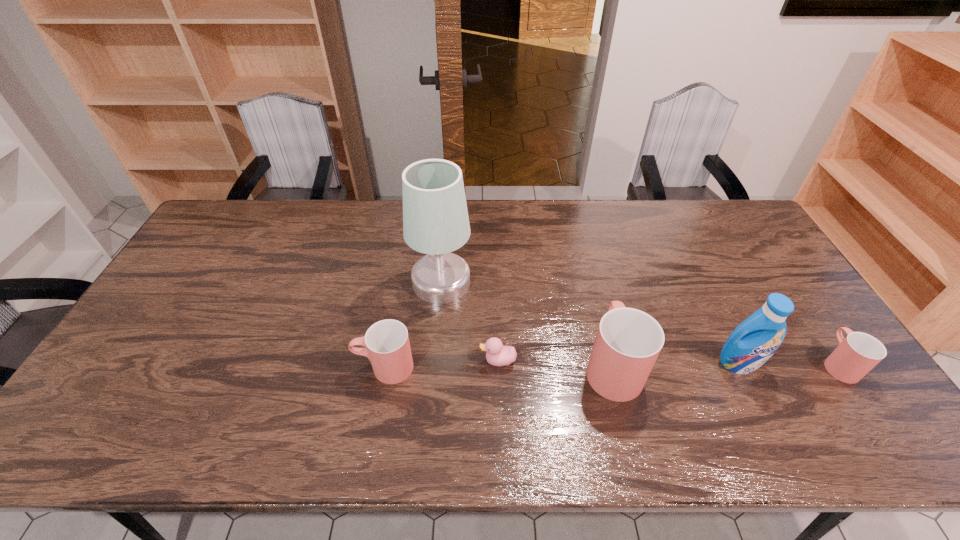
I want to click on free space located on the side of the fifth tallest object with the handle, so click(x=764, y=254).

At what (x,y) coordinates should I click in order to perform the action: click on vacant position located on the base of the farthest object. Please return your answer as a coordinate pair (x, y). Looking at the image, I should click on (571, 282).

You are a GUI agent. You are given a task and a screenshot of the screen. Output one action in this format:
    pyautogui.click(x=<x>, y=<y>)
    Task: Click on the vacant space located on the front-facing side of the duckling
    
    Given the screenshot: What is the action you would take?
    pyautogui.click(x=400, y=361)

Where is `free region located on the front-facing side of the duckling`? free region located on the front-facing side of the duckling is located at coordinates (354, 361).

Locate an element on the screen. vacant space located 0.380m on the front-facing side of the duckling is located at coordinates (335, 361).

Identify the location of object that is at the right edge. (857, 354).

At what (x,y) coordinates should I click in order to perform the action: click on object situated at the near right corner. Please return your answer as a coordinate pair (x, y). The image size is (960, 540). Looking at the image, I should click on (857, 354).

The width and height of the screenshot is (960, 540). In order to click on free space at the far edge of the desktop in this screenshot , I will do tap(284, 240).

Identify the location of vacant area at the near edge of the desktop. (211, 404).

Find the location of `vacant space at the left edge of the desktop`. vacant space at the left edge of the desktop is located at coordinates (170, 284).